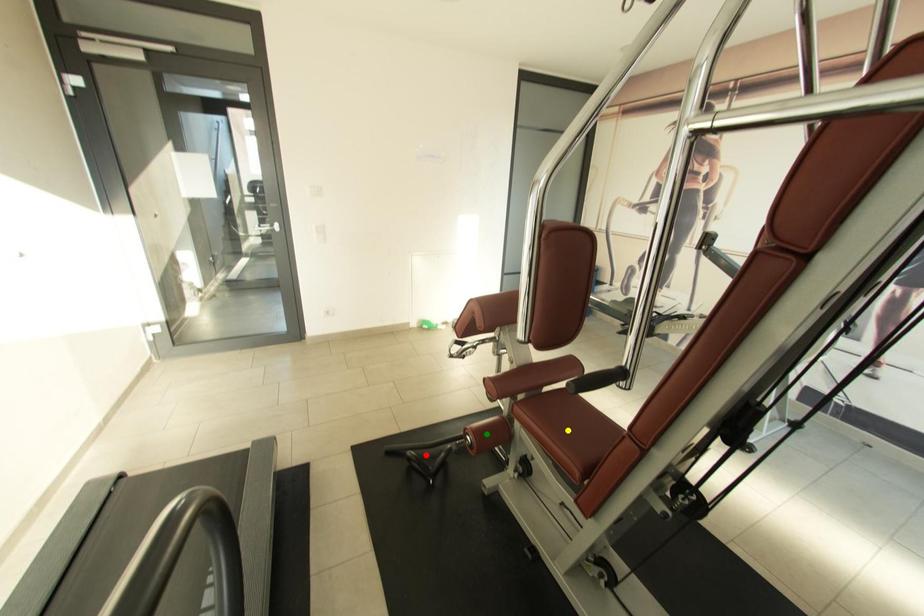
Order these from nearest to farthest:
green point, yellow point, red point

1. red point
2. green point
3. yellow point